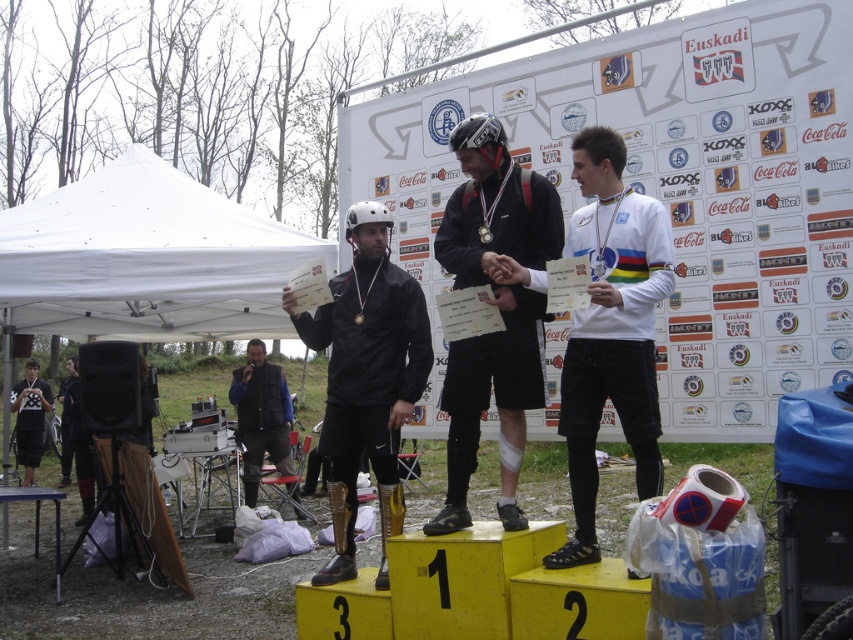
You are a photographer at the event and need to position yourself so that both the white fabric canopy at left and the black leather vest at center are visible in your shot. Given their heights, which object should you position closer to the camera to ensure both are fully visible?

The white fabric canopy at left has a lesser height compared to the black leather vest at center. To ensure both are fully visible, position the white fabric canopy at left closer to the camera since it is shorter and might be obscured if placed further back.

You are a photographer at the event and want to capture a photo of both the black matte jacket at center and the white jersey at left without any overlap. Given their current positions, is this possible?

The black matte jacket at center is positioned over the white jersey at left, so overlapping would occur. To avoid overlap, adjust the camera angle or have the participants move slightly.

You are a photographer at the event and want to ensure both the black matte jacket at center and the white jersey at left are clearly visible in your photo. Given their sizes, which one might you need to position closer to the camera to maintain clarity?

The black matte jacket at center is smaller in size compared to the white jersey at left. To ensure both are clearly visible, you should position the black matte jacket at center closer to the camera since its smaller size might require closer framing for clarity.